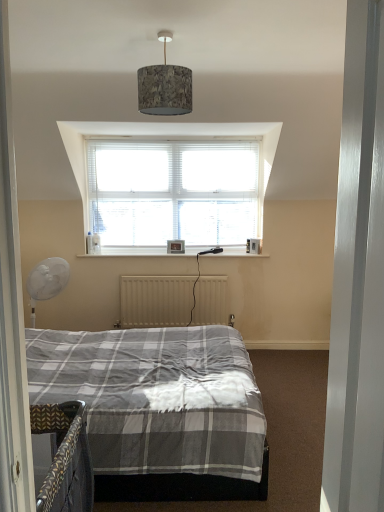
The height and width of the screenshot is (512, 384). What do you see at coordinates (358, 278) in the screenshot?
I see `metallic silver door at right` at bounding box center [358, 278].

What do you see at coordinates (176, 247) in the screenshot? This screenshot has height=512, width=384. I see `wooden picture frame at center` at bounding box center [176, 247].

What is the approximate width of textured fabric lampshade at upper center?

30.54 centimeters.

Find the location of a particular element. The width and height of the screenshot is (384, 512). beige metallic radiator at center is located at coordinates (172, 301).

Which is more distant, (x=339, y=352) or (x=140, y=301)?

Positioned behind is point (x=140, y=301).

Which object is positioned more to the right, metallic silver door at right or beige metallic radiator at center?

metallic silver door at right.

Considering the relative sizes of metallic silver door at right and beige metallic radiator at center in the image provided, is metallic silver door at right smaller than beige metallic radiator at center?

Indeed, metallic silver door at right has a smaller size compared to beige metallic radiator at center.

Considering the positions of points (164, 61) and (181, 252), is point (164, 61) farther from camera compared to point (181, 252)?

No, it is in front of (181, 252).

Is textured fabric lampshade at upper center thinner than wooden picture frame at center?

No.

Which of these two, textured fabric lampshade at upper center or wooden picture frame at center, is bigger?

With larger size is textured fabric lampshade at upper center.

Is wooden picture frame at center surrounded by beige metallic radiator at center?

No, wooden picture frame at center is not a part of beige metallic radiator at center.

Does beige metallic radiator at center turn towards wooden picture frame at center?

No, beige metallic radiator at center is not oriented towards wooden picture frame at center.

From the image's perspective, between beige metallic radiator at center and wooden picture frame at center, which one is located above?

wooden picture frame at center, from the image's perspective.

Is beige metallic radiator at center not near wooden picture frame at center?

beige metallic radiator at center is actually quite close to wooden picture frame at center.

From a real-world perspective, is wooden picture frame at center on beige metallic radiator at center?

Correct, in the physical world, wooden picture frame at center is higher than beige metallic radiator at center.

Is wooden picture frame at center taller or shorter than beige metallic radiator at center?

wooden picture frame at center is shorter than beige metallic radiator at center.

Between wooden picture frame at center and beige metallic radiator at center, which one is positioned in front?

beige metallic radiator at center is closer to the camera.

In the scene shown: Is beige metallic radiator at center thinner than metallic silver door at right?

No, beige metallic radiator at center is not thinner than metallic silver door at right.

Is metallic silver door at right surrounded by beige metallic radiator at center?

Definitely not — metallic silver door at right is not inside beige metallic radiator at center.

In the scene shown: Which object is closer to the camera taking this photo, beige metallic radiator at center or metallic silver door at right?

metallic silver door at right is closer to the camera.

Who is smaller, beige metallic radiator at center or metallic silver door at right?

With smaller size is metallic silver door at right.

How many degrees apart are the facing directions of metallic silver door at right and wooden picture frame at center?

The angular difference between metallic silver door at right and wooden picture frame at center is 87.8 degrees.

From a real-world perspective, is metallic silver door at right on top of wooden picture frame at center?

Indeed, from a real-world perspective, metallic silver door at right stands above wooden picture frame at center.

Are metallic silver door at right and wooden picture frame at center far apart?

metallic silver door at right is positioned a significant distance from wooden picture frame at center.

Between metallic silver door at right and wooden picture frame at center, which one appears on the left side from the viewer's perspective?

From the viewer's perspective, wooden picture frame at center appears more on the left side.

Is textured fabric lampshade at upper center taller than metallic silver door at right?

Incorrect, the height of textured fabric lampshade at upper center is not larger of that of metallic silver door at right.

Does textured fabric lampshade at upper center appear on the right side of metallic silver door at right?

No, textured fabric lampshade at upper center is not to the right of metallic silver door at right.

Who is smaller, textured fabric lampshade at upper center or metallic silver door at right?

metallic silver door at right is smaller.

Image resolution: width=384 pixels, height=512 pixels. In order to click on radiator located below the metallic silver door at right (from the image's perspective) in this screenshot , I will do `click(172, 301)`.

You are a GUI agent. You are given a task and a screenshot of the screen. Output one action in this format:
    pyautogui.click(x=<x>, y=<y>)
    Task: Click on the picture frame located underneath the textured fabric lampshade at upper center (from a real-world perspective)
    This screenshot has width=384, height=512.
    Given the screenshot: What is the action you would take?
    pyautogui.click(x=176, y=247)

Considering their positions, is beige metallic radiator at center positioned further to wooden picture frame at center than metallic silver door at right?

The object further to wooden picture frame at center is metallic silver door at right.

Which object lies nearer to the anchor point beige metallic radiator at center, metallic silver door at right or wooden picture frame at center?

wooden picture frame at center lies closer to beige metallic radiator at center than the other object.

Based on their spatial positions, is metallic silver door at right or wooden picture frame at center closer to textured fabric lampshade at upper center?

metallic silver door at right.

From the image, which object appears to be farther from beige metallic radiator at center, wooden picture frame at center or textured fabric lampshade at upper center?

textured fabric lampshade at upper center.

Based on their spatial positions, is textured fabric lampshade at upper center or wooden picture frame at center further from beige metallic radiator at center?

textured fabric lampshade at upper center is positioned further to the anchor beige metallic radiator at center.

Based on their spatial positions, is wooden picture frame at center or textured fabric lampshade at upper center further from metallic silver door at right?

wooden picture frame at center is positioned further to the anchor metallic silver door at right.

Based on their spatial positions, is metallic silver door at right or beige metallic radiator at center further from wooden picture frame at center?

metallic silver door at right.

Estimate the real-world distances between objects in this image. Which object is further from metallic silver door at right, beige metallic radiator at center or textured fabric lampshade at upper center?

beige metallic radiator at center is positioned further to the anchor metallic silver door at right.

This screenshot has width=384, height=512. Find the location of `radiator positioned between textured fabric lampshade at upper center and wooden picture frame at center from near to far`. radiator positioned between textured fabric lampshade at upper center and wooden picture frame at center from near to far is located at coordinates (172, 301).

Find the location of `radiator between metallic silver door at right and wooden picture frame at center along the z-axis`. radiator between metallic silver door at right and wooden picture frame at center along the z-axis is located at coordinates (172, 301).

What are the coordinates of `lamp located between metallic silver door at right and wooden picture frame at center in the depth direction` in the screenshot? It's located at (164, 86).

Locate an element on the screen. This screenshot has height=512, width=384. lamp positioned between metallic silver door at right and beige metallic radiator at center from near to far is located at coordinates (164, 86).